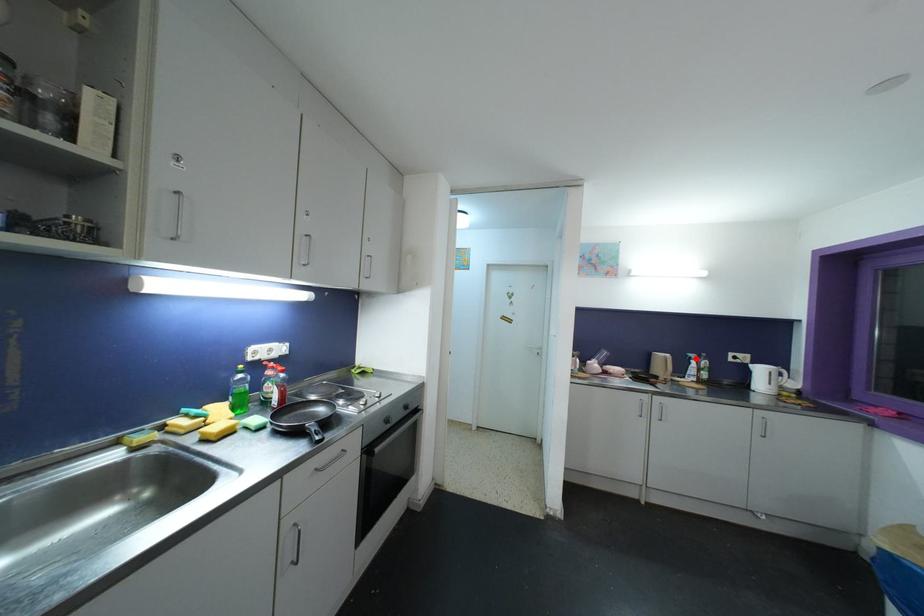
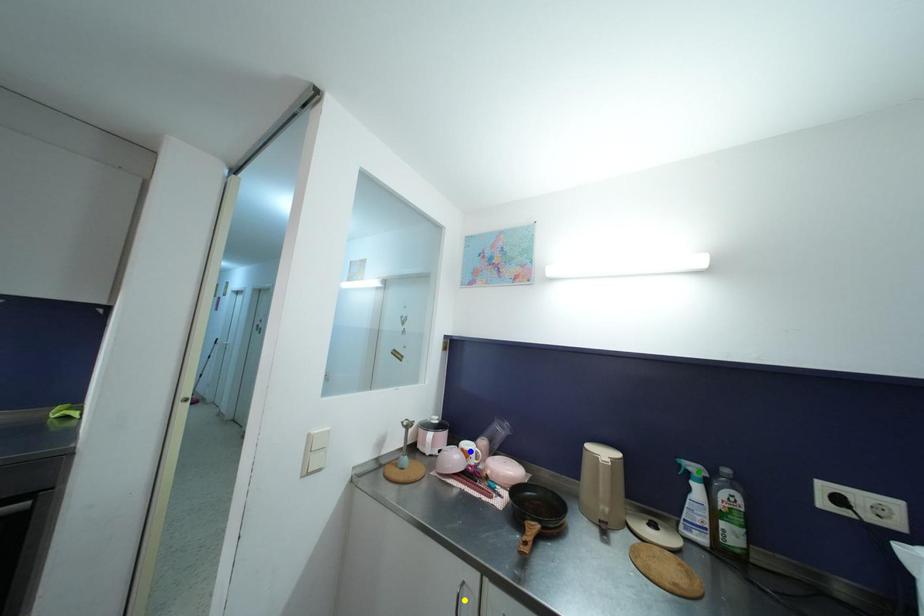
Question: I am providing you with two images of the same scene from different viewpoints. A red point is marked on the first image. You are given multiple points on the second image. In image 2, which mark is for the same physical point as the one in image 1?

Choices:
 (A) yellow point
 (B) blue point
 (C) green point

Answer: (C)